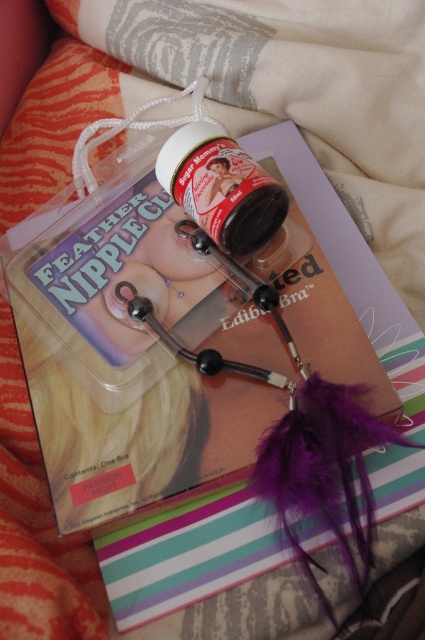
Between purple feathered magazine at center and white matte jar at center, which one has more height?

purple feathered magazine at center

Is purple feathered magazine at center above white matte jar at center?

No.

Where is `purple feathered magazine at center`? This screenshot has height=640, width=425. purple feathered magazine at center is located at coordinates (136, 362).

Where is `purple feathered magazine at center`? This screenshot has height=640, width=425. purple feathered magazine at center is located at coordinates (136, 362).